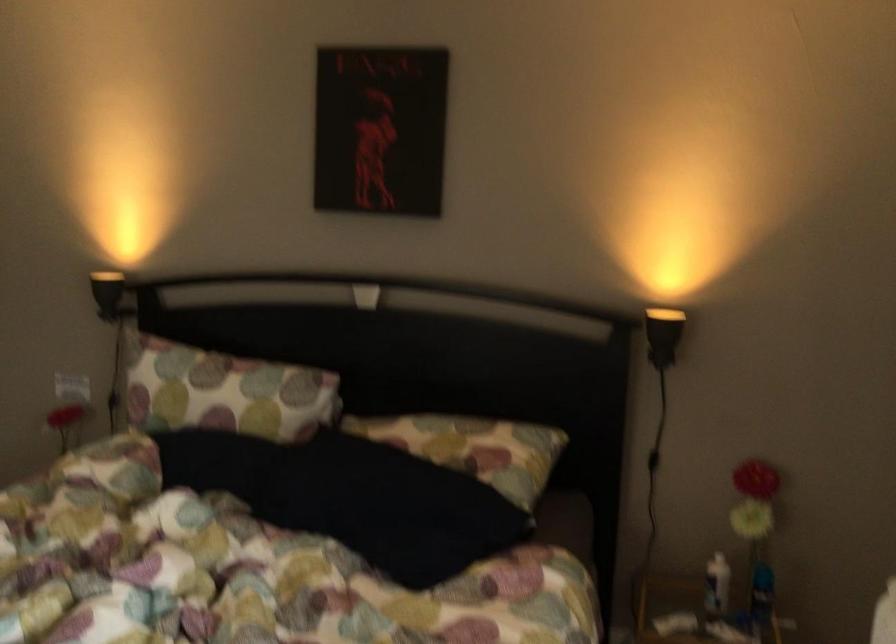
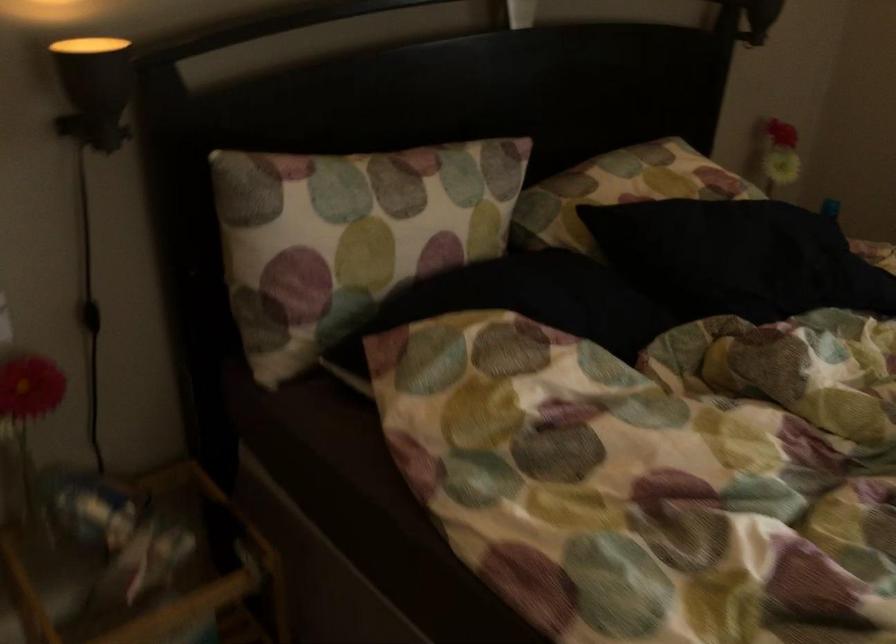
Where in the second image is the point corresponding to pixel 441 439 from the first image?

(649, 176)